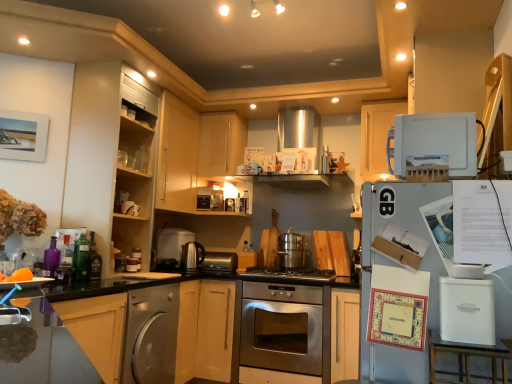
Describe the element at coordinates (434, 143) in the screenshot. I see `white glossy microwave at upper right` at that location.

Identify the location of silver metallic refrigerator at right. The height and width of the screenshot is (384, 512). (409, 231).

Identify the location of matte wood cabinet at upper center, positioned as the 2th cabinetry in right-to-left order. (221, 143).

Describe the element at coordinates (290, 273) in the screenshot. I see `stainless steel gas stove at center` at that location.

Find the location of a particular element. The width and height of the screenshot is (512, 384). white glossy microwave at upper right is located at coordinates (x=434, y=143).

How distant is metallic silver kettle at center, the 1th appliance in the top-to-bottom sequence, from translucent glass bottle at left, which is counted as the 4th bottle, starting from the right?

The distance of metallic silver kettle at center, the 1th appliance in the top-to-bottom sequence, from translucent glass bottle at left, which is counted as the 4th bottle, starting from the right, is 1.86 meters.

Can you confirm if metallic silver kettle at center, marked as the fourth appliance in a left-to-right arrangement, is thinner than translucent glass bottle at left, which ranks as the 2th bottle in left-to-right order?

No.

Is metallic silver kettle at center, the 1th appliance in the top-to-bottom sequence, not near translucent glass bottle at left, which ranks as the 2th bottle in left-to-right order?

That's right, there is a large distance between metallic silver kettle at center, the 1th appliance in the top-to-bottom sequence, and translucent glass bottle at left, which ranks as the 2th bottle in left-to-right order.

Does metallic silver kettle at center, acting as the fifth appliance starting from the bottom, appear on the right side of translucent glass bottle at left, which ranks as the 2th bottle in left-to-right order?

Indeed, metallic silver kettle at center, acting as the fifth appliance starting from the bottom, is positioned on the right side of translucent glass bottle at left, which ranks as the 2th bottle in left-to-right order.

From the stainless steel oven at center, count 2nd cabinetrys backward and point to it. Please provide its 2D coordinates.

[(377, 137)]

Is there a large distance between stainless steel oven at center and white matte cabinet at upper right, positioned as the 3th cabinetry in left-to-right order?

Yes, stainless steel oven at center and white matte cabinet at upper right, positioned as the 3th cabinetry in left-to-right order, are quite far apart.

Does point (310, 298) appear closer or farther from the camera than point (383, 161)?

Point (310, 298) is positioned closer to the camera compared to point (383, 161).

From the image's perspective, which is above, stainless steel oven at center or white matte cabinet at upper right, the first cabinetry positioned from the right?

white matte cabinet at upper right, the first cabinetry positioned from the right, is shown above in the image.

Does translucent glass bottle at center, the first bottle from the back, have a greater width compared to stainless steel gas stove at center?

In fact, translucent glass bottle at center, the first bottle from the back, might be narrower than stainless steel gas stove at center.

Is stainless steel gas stove at center at the back of translucent glass bottle at center, arranged as the first bottle when viewed from the right?

translucent glass bottle at center, arranged as the first bottle when viewed from the right, does not have its back to stainless steel gas stove at center.

Is stainless steel gas stove at center completely or partially inside translucent glass bottle at center, the fifth bottle when ordered from left to right?

No.

Can you confirm if translucent glass bottle at center, the fifth bottle when ordered from left to right, is taller than stainless steel gas stove at center?

Yes, translucent glass bottle at center, the fifth bottle when ordered from left to right, is taller than stainless steel gas stove at center.

Is translucent glass bottle at center, the first bottle from the back, at the back of orange matte fruit at lower left?

orange matte fruit at lower left does not have its back to translucent glass bottle at center, the first bottle from the back.

Considering the relative sizes of orange matte fruit at lower left and translucent glass bottle at center, the fifth bottle from the front, in the image provided, is orange matte fruit at lower left bigger than translucent glass bottle at center, the fifth bottle from the front,?

Incorrect, orange matte fruit at lower left is not larger than translucent glass bottle at center, the fifth bottle from the front.

From a real-world perspective, which bottle is the 5th one above the orange matte fruit at lower left? Please provide its 2D coordinates.

[(356, 260)]

From the image's perspective, which one is positioned lower, orange matte fruit at lower left or translucent glass bottle at center, the fifth bottle from the front?

translucent glass bottle at center, the fifth bottle from the front, from the image's perspective.

Is stainless steel oven at center not inside orange matte fruit at lower left?

stainless steel oven at center lies outside orange matte fruit at lower left's area.

Does stainless steel oven at center have a larger size compared to orange matte fruit at lower left?

Indeed, stainless steel oven at center has a larger size compared to orange matte fruit at lower left.

You are a GUI agent. You are given a task and a screenshot of the screen. Output one action in this format:
    pyautogui.click(x=<x>, y=<y>)
    Task: Click on the food located on the left of stainless steel oven at center
    This screenshot has width=512, height=384.
    Given the screenshot: What is the action you would take?
    pos(17,276)

Which of these two, wooden shelves at upper center, the 1th cabinetry when ordered from left to right, or white glossy microwave at upper right, is thinner?

white glossy microwave at upper right is thinner.

Which is in front, wooden shelves at upper center, the 1th cabinetry when ordered from left to right, or white glossy microwave at upper right?

Positioned in front is white glossy microwave at upper right.

Does point (219, 175) come behind point (419, 153)?

Yes, it is.

Looking at the image, does wooden shelves at upper center, the 1th cabinetry when ordered from left to right, seem bigger or smaller compared to white glossy microwave at upper right?

Clearly, wooden shelves at upper center, the 1th cabinetry when ordered from left to right, is larger in size than white glossy microwave at upper right.

Which object is further away from the camera taking this photo, stainless steel gas stove at center or green glass bottle at lower left, the 3th bottle viewed from the left?

stainless steel gas stove at center is further away from the camera.

Consider the image. Which of these two, stainless steel gas stove at center or green glass bottle at lower left, the 3th bottle viewed from the left, stands taller?

green glass bottle at lower left, the 3th bottle viewed from the left, is taller.

From a real-world perspective, between stainless steel gas stove at center and green glass bottle at lower left, marked as the third bottle in a back-to-front arrangement, who is vertically higher?

green glass bottle at lower left, marked as the third bottle in a back-to-front arrangement, is physically above.

Are stainless steel gas stove at center and green glass bottle at lower left, the 3th bottle positioned from the front, far apart?

stainless steel gas stove at center is positioned a significant distance from green glass bottle at lower left, the 3th bottle positioned from the front.

Where is `bottle that is the 3rd object to the left of the metallic silver kettle at center, marked as the fourth appliance in a left-to-right arrangement, starting at the anchor`? bottle that is the 3rd object to the left of the metallic silver kettle at center, marked as the fourth appliance in a left-to-right arrangement, starting at the anchor is located at coordinates (65, 262).

Where is `the 2nd cabinetry positioned above the stainless steel oven at center (from a real-world perspective)`? The width and height of the screenshot is (512, 384). the 2nd cabinetry positioned above the stainless steel oven at center (from a real-world perspective) is located at coordinates [377, 137].

Based on the photo, when comparing their distances from green glass bottle at left, placed as the fourth bottle when sorted from left to right, does satin silver toaster at center, the 3th appliance in the left-to-right sequence, or purple glass bottle at left, positioned as the first bottle in left-to-right order, seem closer?

purple glass bottle at left, positioned as the first bottle in left-to-right order, is positioned closer to the anchor green glass bottle at left, placed as the fourth bottle when sorted from left to right.

Estimate the real-world distances between objects in this image. Which object is further from satin silver toaster at center, which is the fifth appliance from right to left, white matte cabinet at upper right, positioned as the 3th cabinetry in left-to-right order, or orange matte fruit at lower left?

white matte cabinet at upper right, positioned as the 3th cabinetry in left-to-right order, lies further to satin silver toaster at center, which is the fifth appliance from right to left, than the other object.

When comparing their distances from satin silver dishwasher at lower left, does matte wood cabinet at upper center, positioned as the 2th cabinetry in right-to-left order, or satin nickel kettle at center, the third appliance in the front-to-back sequence, seem further?

The object further to satin silver dishwasher at lower left is matte wood cabinet at upper center, positioned as the 2th cabinetry in right-to-left order.

When comparing their distances from satin silver toaster at center, which is the first appliance in left-to-right order, does translucent glass bottle at left, which is counted as the 4th bottle, starting from the right, or silver metallic refrigerator at right seem further?

Among the two, silver metallic refrigerator at right is located further to satin silver toaster at center, which is the first appliance in left-to-right order.

Estimate the real-world distances between objects in this image. Which object is closer to satin nickel kettle at center, the 2th appliance ordered from the bottom, stainless steel oven at center or wooden shelves at upper center, the 1th cabinetry when ordered from left to right?

Among the two, wooden shelves at upper center, the 1th cabinetry when ordered from left to right, is located nearer to satin nickel kettle at center, the 2th appliance ordered from the bottom.

Looking at the image, which one is located closer to satin silver toaster at center, acting as the 5th appliance starting from the front, orange matte fruit at lower left or metallic silver kettle at center, the 1th appliance in the top-to-bottom sequence?

metallic silver kettle at center, the 1th appliance in the top-to-bottom sequence, lies closer to satin silver toaster at center, acting as the 5th appliance starting from the front, than the other object.

From the image, which object appears to be nearer to orange matte fruit at lower left, satin silver dishwasher at lower left or silver metallic refrigerator at right?

Among the two, satin silver dishwasher at lower left is located nearer to orange matte fruit at lower left.

Which object lies further to the anchor point matte wood cabinet at upper center, positioned as the 2th cabinetry in right-to-left order, silver metallic refrigerator at right or white matte cabinet at upper right, the first cabinetry positioned from the right?

Among the two, silver metallic refrigerator at right is located further to matte wood cabinet at upper center, positioned as the 2th cabinetry in right-to-left order.

Locate an element on the screen. gas stove situated between green glass bottle at left, arranged as the fourth bottle when viewed from the front, and translucent glass bottle at center, the fifth bottle when ordered from left to right, from left to right is located at coordinates (290, 273).

Locate an element on the screen. Image resolution: width=512 pixels, height=384 pixels. bottle situated between green glass bottle at lower left, the 3th bottle viewed from the left, and metallic silver kettle at center, the 1th appliance in the top-to-bottom sequence, from left to right is located at coordinates (94, 261).

Locate an element on the screen. The width and height of the screenshot is (512, 384). dish washer between white matte water dispenser at right, the 1th appliance from the front, and white matte cabinet at upper right, the first cabinetry positioned from the right, along the z-axis is located at coordinates (151, 335).

Identify the location of bottle located between green glass bottle at lower left, arranged as the 3th bottle when viewed from the right, and stainless steel gas stove at center in the left-right direction. (94, 261).